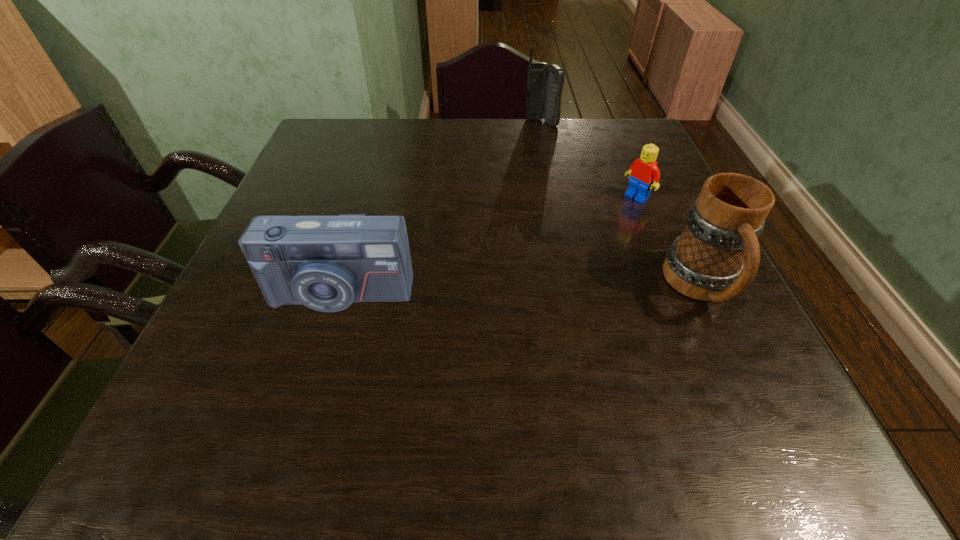
At what (x,y) coordinates should I click in order to perform the action: click on vacant spot on the desktop that is between the leftmost object and the mug and is positioned on the face of the Lego. Please return your answer as a coordinate pair (x, y). Looking at the image, I should click on (499, 291).

Find the location of a particular element. vacant space on the desktop that is between the leftmost object and the mug and is positioned on the keyboard of the third object from right to left is located at coordinates (560, 290).